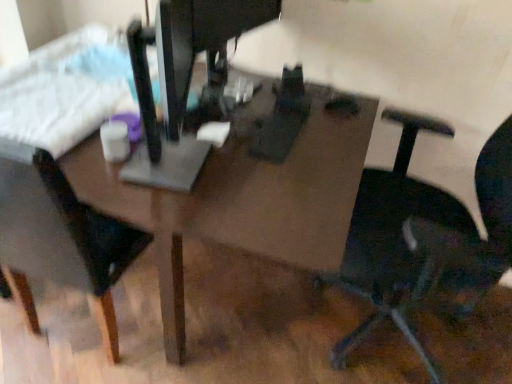
What is the approximate height of black plastic chair at right, which is the 1th chair from right to left?

The height of black plastic chair at right, which is the 1th chair from right to left, is 3.58 feet.

The height and width of the screenshot is (384, 512). What do you see at coordinates (393, 240) in the screenshot?
I see `black plastic chair at right, positioned as the second chair in left-to-right order` at bounding box center [393, 240].

What do you see at coordinates (182, 80) in the screenshot?
I see `metallic gray sewing machine at center` at bounding box center [182, 80].

The width and height of the screenshot is (512, 384). What do you see at coordinates (60, 92) in the screenshot?
I see `white plastic keyboard at upper left` at bounding box center [60, 92].

In order to face white plastic keyboard at upper left, should I rotate leftwards or rightwards?

A 23.799 degree turn to the left will do.

Identify the location of black plastic chair at right, positioned as the second chair in left-to-right order. (393, 240).

Considering the sizes of objects white plastic keyboard at upper left and metallic gray sewing machine at center in the image provided, who is bigger, white plastic keyboard at upper left or metallic gray sewing machine at center?

With larger size is metallic gray sewing machine at center.

Is white plastic keyboard at upper left not inside metallic gray sewing machine at center?

white plastic keyboard at upper left lies outside metallic gray sewing machine at center's area.

Between white plastic keyboard at upper left and metallic gray sewing machine at center, which one has smaller width?

With smaller width is metallic gray sewing machine at center.

Is point (24, 173) positioned in front of point (112, 197)?

That is False.

Is black matte chair at left, the first chair viewed from the left, placed right next to matte brown table at center?

There is a gap between black matte chair at left, the first chair viewed from the left, and matte brown table at center.

Looking at their sizes, would you say black matte chair at left, the first chair viewed from the left, is wider or thinner than matte brown table at center?

Clearly, black matte chair at left, the first chair viewed from the left, has less width compared to matte brown table at center.

Considering the relative sizes of black matte chair at left, the first chair viewed from the left, and matte brown table at center in the image provided, is black matte chair at left, the first chair viewed from the left, taller than matte brown table at center?

Yes.

From the image's perspective, does white plastic keyboard at upper left appear higher than black matte chair at left, the first chair viewed from the left?

Indeed, from the image's perspective, white plastic keyboard at upper left is shown above black matte chair at left, the first chair viewed from the left.

How far apart are white plastic keyboard at upper left and black matte chair at left, the first chair viewed from the left?

The distance of white plastic keyboard at upper left from black matte chair at left, the first chair viewed from the left, is 13.85 inches.

Looking at this image, which of these two, white plastic keyboard at upper left or black matte chair at left, marked as the 2th chair in a right-to-left arrangement, stands shorter?

Standing shorter between the two is white plastic keyboard at upper left.

Consider the image. Is white plastic keyboard at upper left positioned in front of black matte chair at left, the first chair viewed from the left?

No, white plastic keyboard at upper left is further to the viewer.

Considering the relative sizes of matte brown table at center and black matte chair at left, marked as the 2th chair in a right-to-left arrangement, in the image provided, is matte brown table at center bigger than black matte chair at left, marked as the 2th chair in a right-to-left arrangement,?

Correct, matte brown table at center is larger in size than black matte chair at left, marked as the 2th chair in a right-to-left arrangement.

Which is more to the right, matte brown table at center or black matte chair at left, marked as the 2th chair in a right-to-left arrangement?

matte brown table at center.

Looking at this image, considering the positions of objects matte brown table at center and black matte chair at left, the first chair viewed from the left, in the image provided, who is in front, matte brown table at center or black matte chair at left, the first chair viewed from the left,?

black matte chair at left, the first chair viewed from the left.

Would you consider metallic gray sewing machine at center to be distant from matte brown table at center?

That's not correct — metallic gray sewing machine at center is a little close to matte brown table at center.

Identify the location of table that is behind the metallic gray sewing machine at center. This screenshot has height=384, width=512. (243, 196).

Looking at this image, is metallic gray sewing machine at center at the right side of matte brown table at center?

Yes.

Considering the sizes of metallic gray sewing machine at center and white plastic keyboard at upper left in the image, is metallic gray sewing machine at center bigger or smaller than white plastic keyboard at upper left?

Clearly, metallic gray sewing machine at center is larger in size than white plastic keyboard at upper left.

Is white plastic keyboard at upper left at the back of metallic gray sewing machine at center?

Absolutely, metallic gray sewing machine at center is directed away from white plastic keyboard at upper left.

Who is taller, metallic gray sewing machine at center or white plastic keyboard at upper left?

metallic gray sewing machine at center.

Is metallic gray sewing machine at center situated inside white plastic keyboard at upper left or outside?

metallic gray sewing machine at center cannot be found inside white plastic keyboard at upper left.

Does black plastic chair at right, positioned as the second chair in left-to-right order, come in front of white plastic keyboard at upper left?

That is True.

Is white plastic keyboard at upper left located within black plastic chair at right, which is the 1th chair from right to left?

No, black plastic chair at right, which is the 1th chair from right to left, does not contain white plastic keyboard at upper left.

Is black plastic chair at right, which is the 1th chair from right to left, facing away from white plastic keyboard at upper left?

black plastic chair at right, which is the 1th chair from right to left, does not have its back to white plastic keyboard at upper left.

Where is `sewing machine above the white plastic keyboard at upper left (from a real-world perspective)`? The width and height of the screenshot is (512, 384). sewing machine above the white plastic keyboard at upper left (from a real-world perspective) is located at coordinates tap(182, 80).

From the image's perspective, count 1st chairs downward from the matte brown table at center and point to it. Please provide its 2D coordinates.

[(60, 236)]

Looking at this image, considering their positions, is black plastic chair at right, positioned as the second chair in left-to-right order, positioned closer to white plastic keyboard at upper left than matte brown table at center?

matte brown table at center lies closer to white plastic keyboard at upper left than the other object.

Considering their positions, is black plastic chair at right, positioned as the second chair in left-to-right order, positioned further to matte brown table at center than black matte chair at left, the first chair viewed from the left?

black plastic chair at right, positioned as the second chair in left-to-right order, is further to matte brown table at center.

Based on the photo, from the image, which object appears to be nearer to matte brown table at center, black matte chair at left, marked as the 2th chair in a right-to-left arrangement, or metallic gray sewing machine at center?

Based on the image, metallic gray sewing machine at center appears to be nearer to matte brown table at center.

Considering their positions, is black plastic chair at right, which is the 1th chair from right to left, positioned further to metallic gray sewing machine at center than matte brown table at center?

Based on the image, black plastic chair at right, which is the 1th chair from right to left, appears to be further to metallic gray sewing machine at center.

Looking at the image, which one is located closer to black plastic chair at right, which is the 1th chair from right to left, matte brown table at center or black matte chair at left, marked as the 2th chair in a right-to-left arrangement?

matte brown table at center is positioned closer to the anchor black plastic chair at right, which is the 1th chair from right to left.

Based on their spatial positions, is black plastic chair at right, which is the 1th chair from right to left, or matte brown table at center further from black matte chair at left, marked as the 2th chair in a right-to-left arrangement?

The object further to black matte chair at left, marked as the 2th chair in a right-to-left arrangement, is black plastic chair at right, which is the 1th chair from right to left.

Which object lies nearer to the anchor point black matte chair at left, marked as the 2th chair in a right-to-left arrangement, white plastic keyboard at upper left or matte brown table at center?

matte brown table at center is positioned closer to the anchor black matte chair at left, marked as the 2th chair in a right-to-left arrangement.

Looking at the image, which one is located further to matte brown table at center, black matte chair at left, marked as the 2th chair in a right-to-left arrangement, or white plastic keyboard at upper left?

The object further to matte brown table at center is white plastic keyboard at upper left.

What are the coordinates of `table between white plastic keyboard at upper left and black plastic chair at right, which is the 1th chair from right to left` in the screenshot? It's located at (243, 196).

Identify the location of table between black matte chair at left, the first chair viewed from the left, and metallic gray sewing machine at center. (243, 196).

Identify the location of table located between white plastic keyboard at upper left and metallic gray sewing machine at center in the left-right direction. The width and height of the screenshot is (512, 384). (243, 196).

Locate an element on the screen. The width and height of the screenshot is (512, 384). table between black matte chair at left, marked as the 2th chair in a right-to-left arrangement, and black plastic chair at right, which is the 1th chair from right to left is located at coordinates (243, 196).